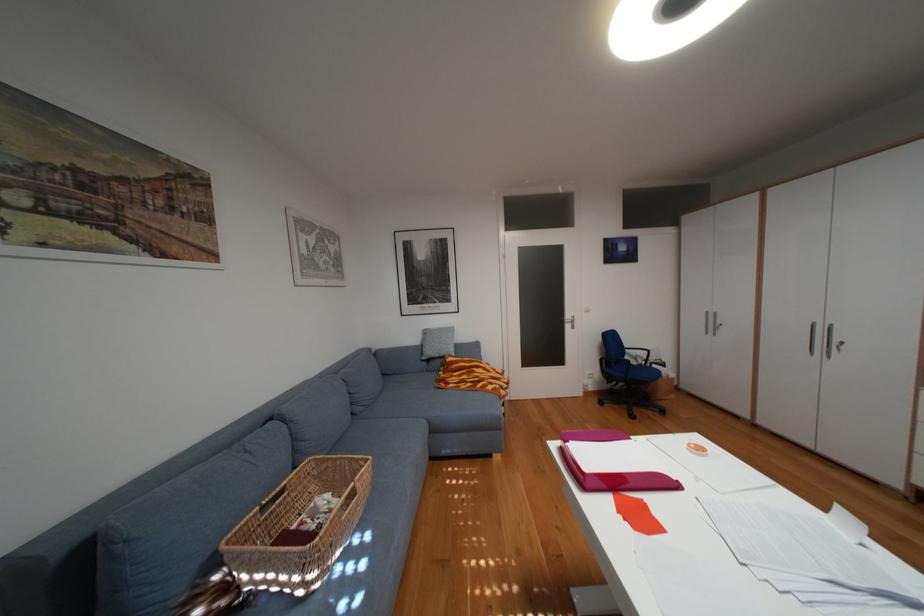
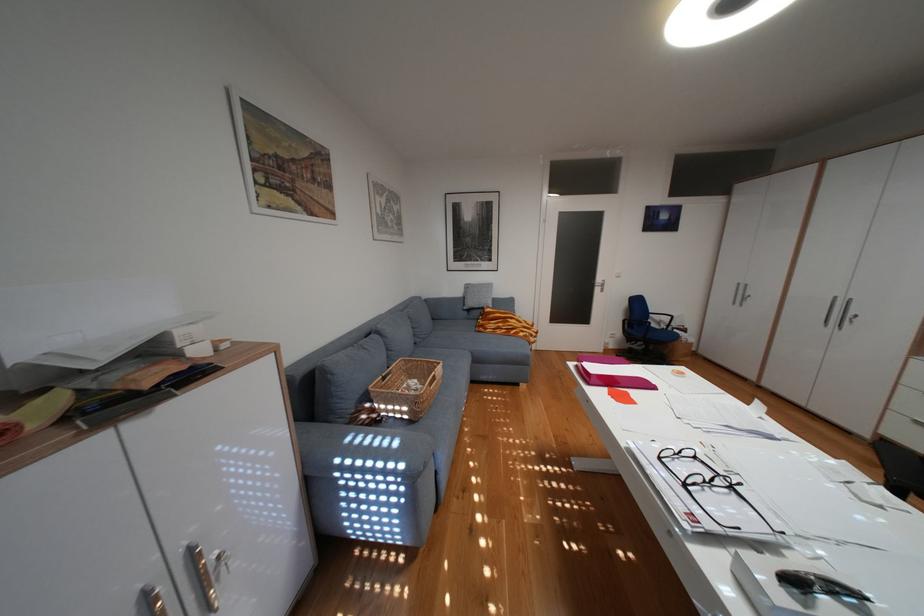
Question: The images are taken continuously from a first-person perspective. In which direction are you moving?

Choices:
 (A) Left
 (B) Right
 (C) Forward
 (D) Backward

Answer: (D)